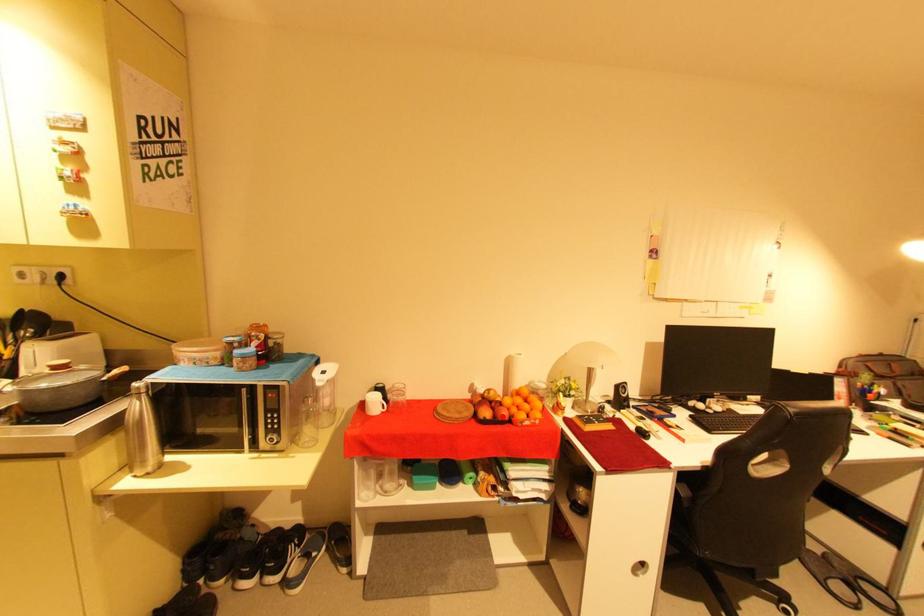
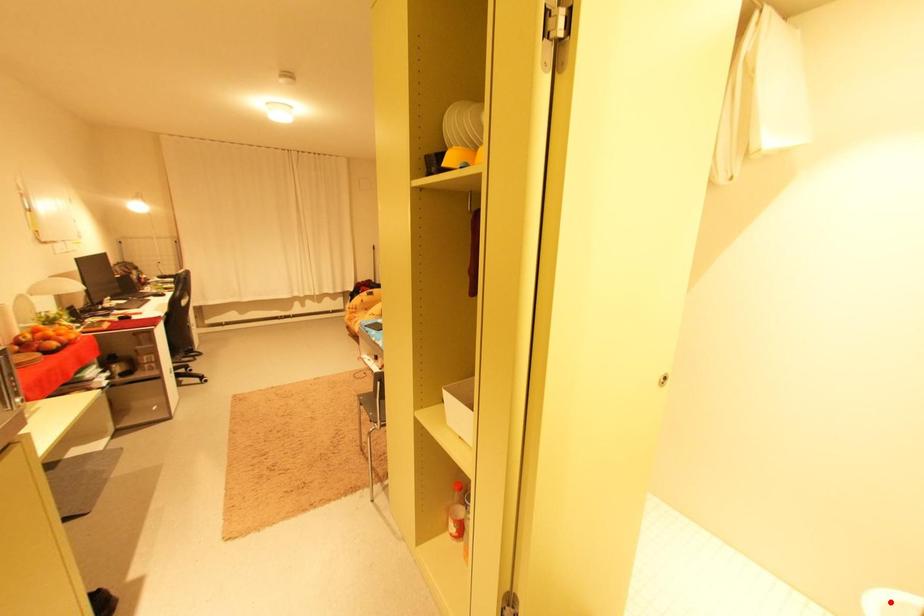
I am providing you with two images of the same scene from different viewpoints. A red point is marked on the first image and another point is marked on the second image. Is the red point in image1 aligned with the point shown in image2?

No